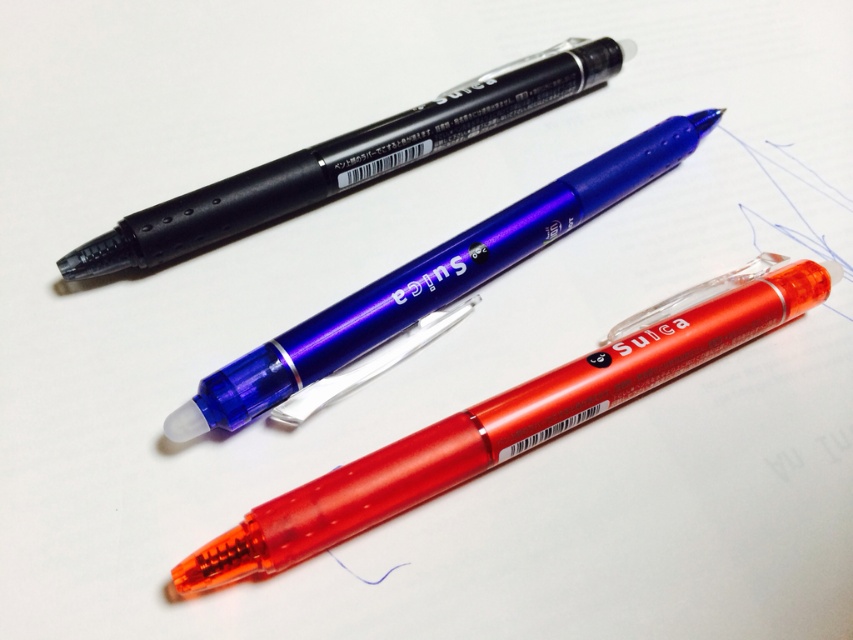
Question: Does translucent blue pen at center appear on the right side of matte black pen at upper center?

Choices:
 (A) yes
 (B) no

Answer: (A)

Question: Among these points, which one is farthest from the camera?

Choices:
 (A) (341, 170)
 (B) (332, 504)

Answer: (A)

Question: Is translucent blue pen at center thinner than matte black pen at upper center?

Choices:
 (A) no
 (B) yes

Answer: (B)

Question: Can you confirm if transparent orange pen at center is positioned below translucent blue pen at center?

Choices:
 (A) no
 (B) yes

Answer: (B)

Question: Among these points, which one is farthest from the camera?

Choices:
 (A) (718, 108)
 (B) (637, 336)

Answer: (A)

Question: Which is farther from the transparent orange pen at center?

Choices:
 (A) translucent blue pen at center
 (B) matte black pen at upper center

Answer: (B)